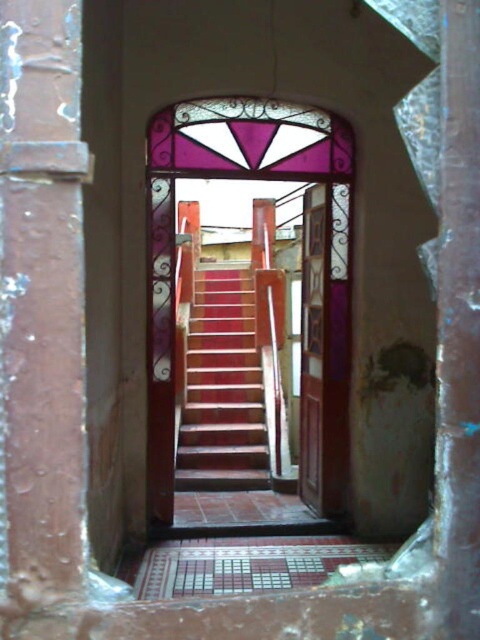
Question: Which object appears closest to the camera in this image?

Choices:
 (A) translucent stained glass at center
 (B) wooden stairs at center

Answer: (A)

Question: Among these objects, which one is farthest from the camera?

Choices:
 (A) rusty metal pillar at left
 (B) wooden stairs at center

Answer: (B)

Question: Which object appears closest to the camera in this image?

Choices:
 (A) smooth concrete pillar at right
 (B) wooden door at center
 (C) wooden stairs at center

Answer: (A)

Question: Does translucent stained glass at center have a smaller size compared to wooden door at center?

Choices:
 (A) yes
 (B) no

Answer: (B)

Question: Where is translucent stained glass at center located in relation to wooden stairs at center in the image?

Choices:
 (A) above
 (B) below

Answer: (A)

Question: Does translucent stained glass at center appear under wooden door at center?

Choices:
 (A) no
 (B) yes

Answer: (A)